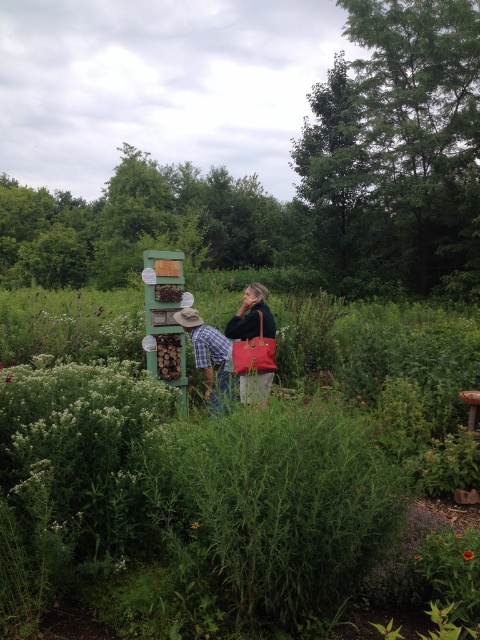
You are a gardener who wants to water the flowers in the garden. You have a watering can and are standing in front of the yellow matte flower at center and the purple matte flower at center. Which flower should you water first if you want to reach the one closer to you?

The yellow matte flower at center is in front of the purple matte flower at center, so you should water the yellow matte flower at center first as it is closer to you.

You are standing in the garden scene and want to take a photo of both the point at coordinates (213, 579) and the point at (204, 326). Which point should you focus on first to ensure both are in focus?

You should focus on the point at coordinates (204, 326) first because it is farther from the camera than the point at (213, 579). By focusing on the farther point, both points will be within the depth of field and in focus.